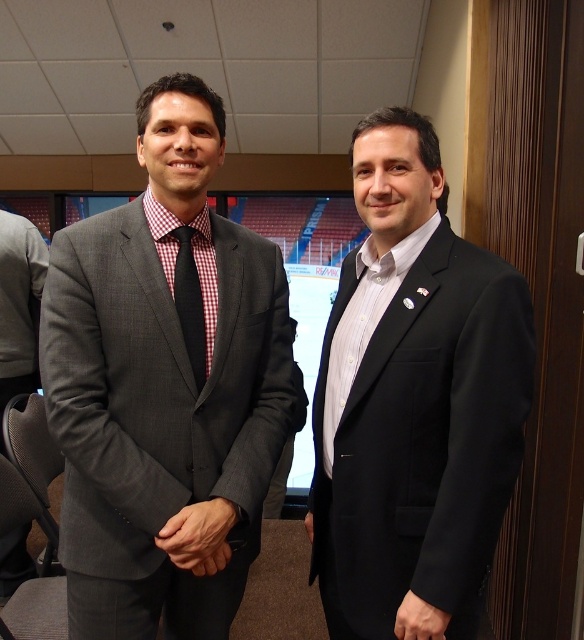
You are taking a photo of two points in the image. The first point is at coordinates point (165, 536) and the second is at point (178, 282). Which point will appear larger in your photo?

Point (165, 536) is closer to the camera than point (178, 282), so it will appear larger in the photo.

You are an event planner organizing a photoshoot in this conference room. You need to decide which object, the matte gray suit at left or the matte black hand at center, would require more space in the frame to capture fully. Which one should you prioritize positioning first?

The matte gray suit at left is bigger than the matte black hand at center, so you should prioritize positioning the matte gray suit at left first to ensure it fits properly in the frame.